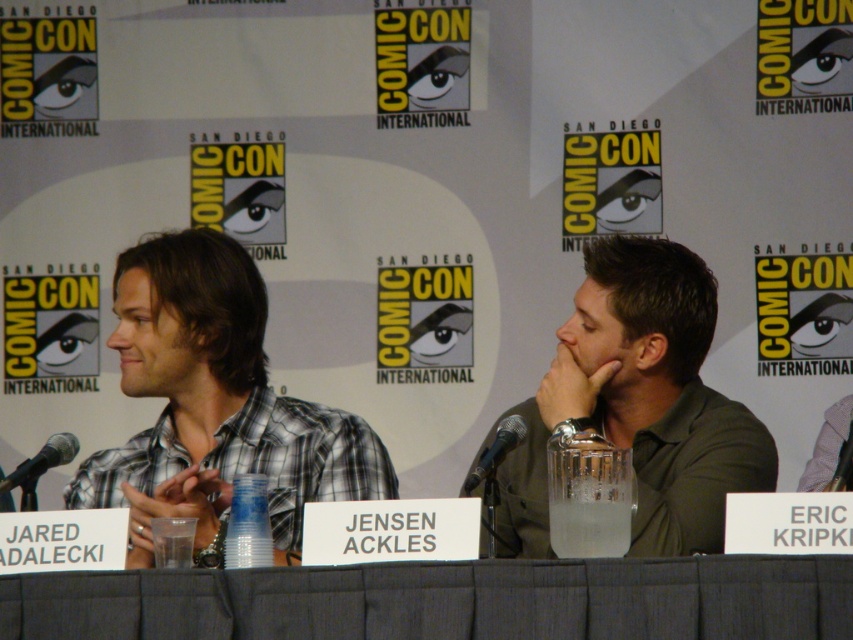
Between plaid shirt at center and green matte shirt at center, which one appears on the right side from the viewer's perspective?

green matte shirt at center is more to the right.

Is point (231, 243) in front of point (740, 435)?

That is False.

Does point (387, 477) come closer to viewer compared to point (527, 540)?

No, (387, 477) is further to viewer.

Identify the location of plaid shirt at center. (216, 403).

Who is lower down, plaid shirt at center or black metallic microphone at center?

plaid shirt at center is below.

Is plaid shirt at center bigger than black metallic microphone at center?

Yes.

This screenshot has height=640, width=853. I want to click on plaid shirt at center, so click(216, 403).

Where is `plaid shirt at center`? The height and width of the screenshot is (640, 853). plaid shirt at center is located at coordinates (216, 403).

Between gray fabric table at center and black metallic microphone at left, which one is positioned higher?

black metallic microphone at left is higher up.

The width and height of the screenshot is (853, 640). I want to click on gray fabric table at center, so click(x=445, y=600).

This screenshot has width=853, height=640. In order to click on gray fabric table at center in this screenshot , I will do `click(445, 600)`.